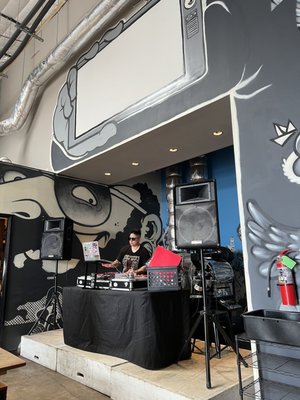
Find the location of a particular element. stand is located at coordinates (207, 332).